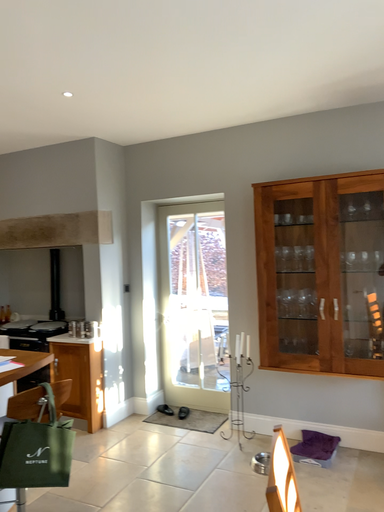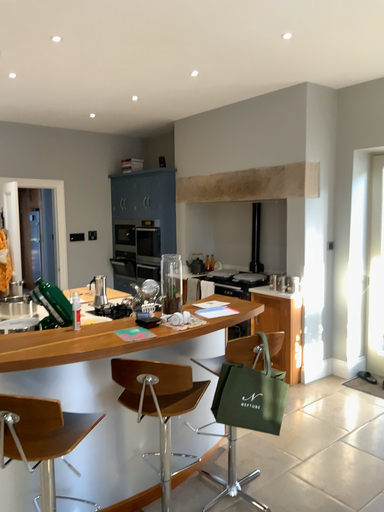
Question: Which way did the camera rotate in the video?

Choices:
 (A) rotated left
 (B) rotated right

Answer: (A)